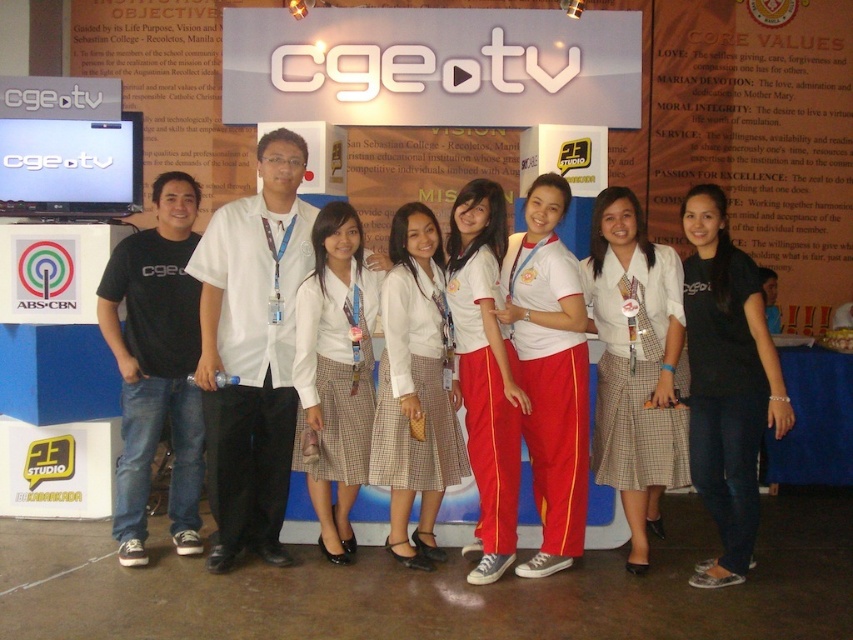
Question: Which of the following is the farthest from the observer?

Choices:
 (A) plaid skirt at center
 (B) black cotton shirt at right

Answer: (A)

Question: Which point is closer to the camera?

Choices:
 (A) plaid skirt at center
 (B) white plaid skirt at center
 (C) black cotton shirt at right

Answer: (C)

Question: Can you confirm if white plaid skirt at center is positioned above white cotton pants at center?

Choices:
 (A) yes
 (B) no

Answer: (B)

Question: Does black cotton shirt at right appear under plaid skirt at center?

Choices:
 (A) yes
 (B) no

Answer: (B)

Question: Which object appears closest to the camera in this image?

Choices:
 (A) black cotton shirt at right
 (B) plaid skirt at center

Answer: (A)

Question: Can you confirm if plaid skirt at center is thinner than white plaid skirt at center?

Choices:
 (A) no
 (B) yes

Answer: (A)